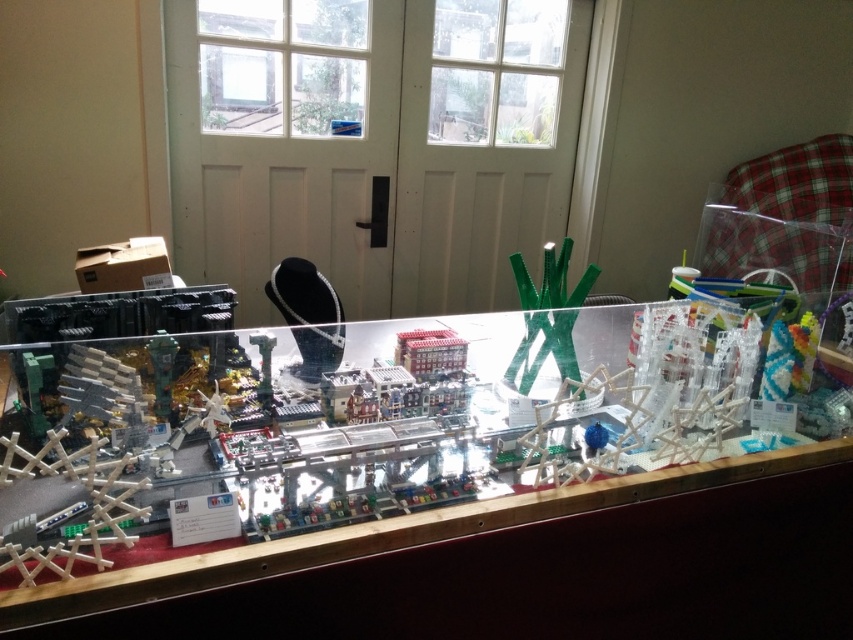
Question: Does green matte plastic x at center appear under pearl necklace at center?

Choices:
 (A) no
 (B) yes

Answer: (B)

Question: Which point is closer to the camera?

Choices:
 (A) pearl necklace at center
 (B) clear plastic table at center
 (C) green matte plastic x at center

Answer: (B)

Question: Can you confirm if clear plastic table at center is positioned above green matte plastic x at center?

Choices:
 (A) no
 (B) yes

Answer: (A)

Question: Which is nearer to the clear plastic table at center?

Choices:
 (A) pearl necklace at center
 (B) green matte plastic x at center

Answer: (B)

Question: Estimate the real-world distances between objects in this image. Which object is farther from the green matte plastic x at center?

Choices:
 (A) pearl necklace at center
 (B) clear plastic table at center

Answer: (A)

Question: Is the position of clear plastic table at center less distant than that of pearl necklace at center?

Choices:
 (A) no
 (B) yes

Answer: (B)